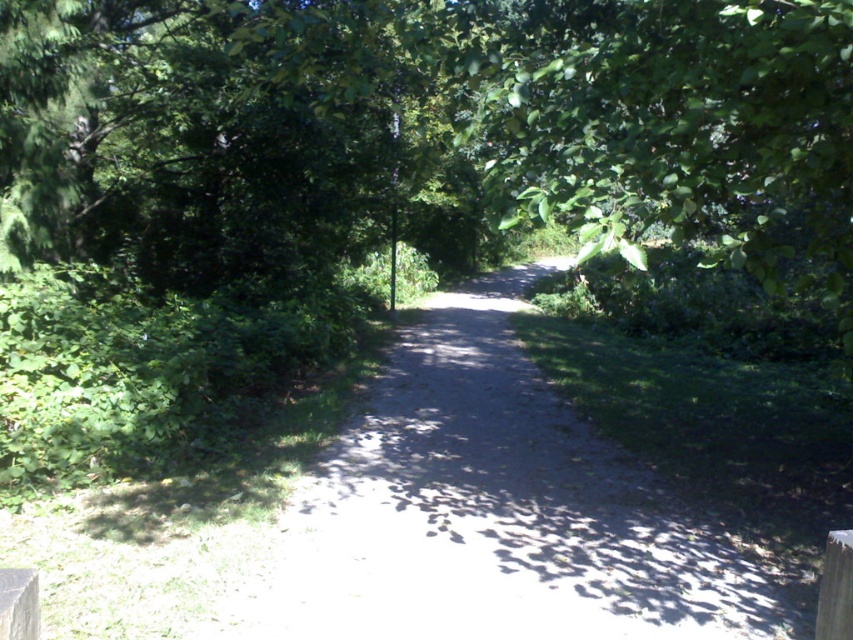
Question: Which point is farther to the camera?

Choices:
 (A) (4, 627)
 (B) (851, 627)

Answer: (B)

Question: Is dirt path at center thinner than smooth gray wood at lower left?

Choices:
 (A) no
 (B) yes

Answer: (A)

Question: Can you confirm if brown wooden post at lower right is wider than smooth gray wood at lower left?

Choices:
 (A) no
 (B) yes

Answer: (A)

Question: Does dirt path at center appear on the left side of brown wooden post at lower right?

Choices:
 (A) no
 (B) yes

Answer: (B)

Question: Which of the following is the farthest from the observer?

Choices:
 (A) (0, 632)
 (B) (404, 387)

Answer: (B)

Question: Which object is the closest to the brown wooden post at lower right?

Choices:
 (A) smooth gray wood at lower left
 (B) dirt path at center

Answer: (A)